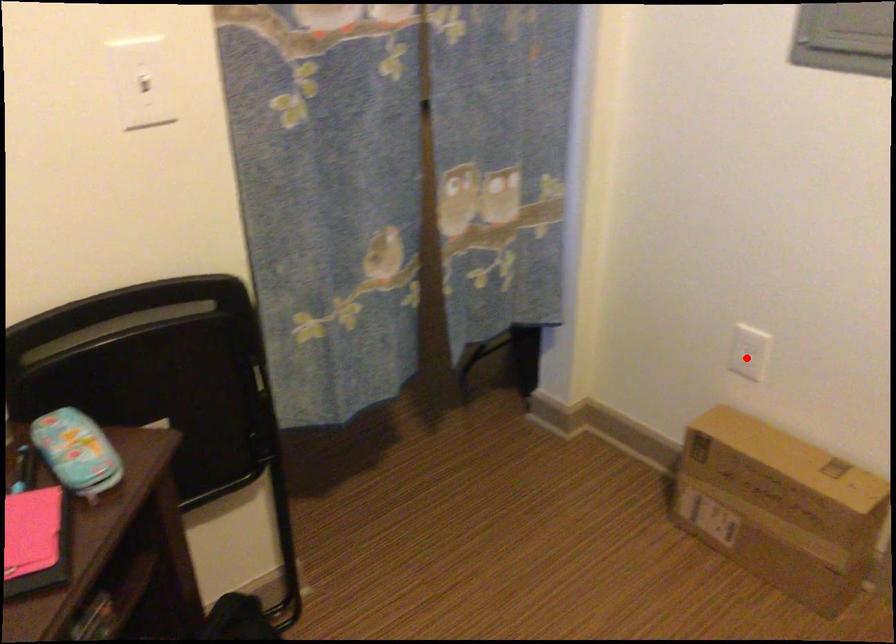
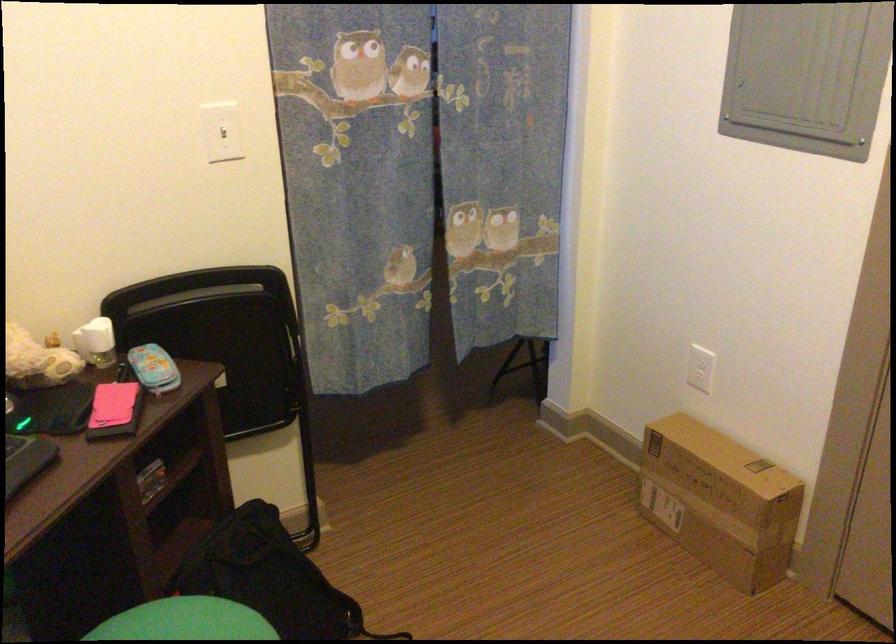
Question: I am providing you with two images of the same scene from different viewpoints. Given a red point in image1, look at the same physical point in image2. Is it:

Choices:
 (A) Closer to the viewpoint
 (B) Farther from the viewpoint

Answer: (B)